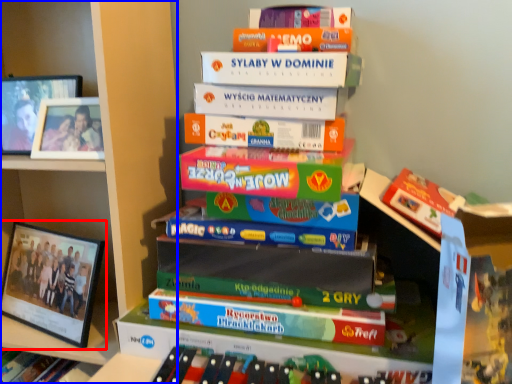
Question: Which point is closer to the camera, picture frame (highlighted by a red box) or bookcase (highlighted by a blue box)?

Choices:
 (A) picture frame
 (B) bookcase

Answer: (B)